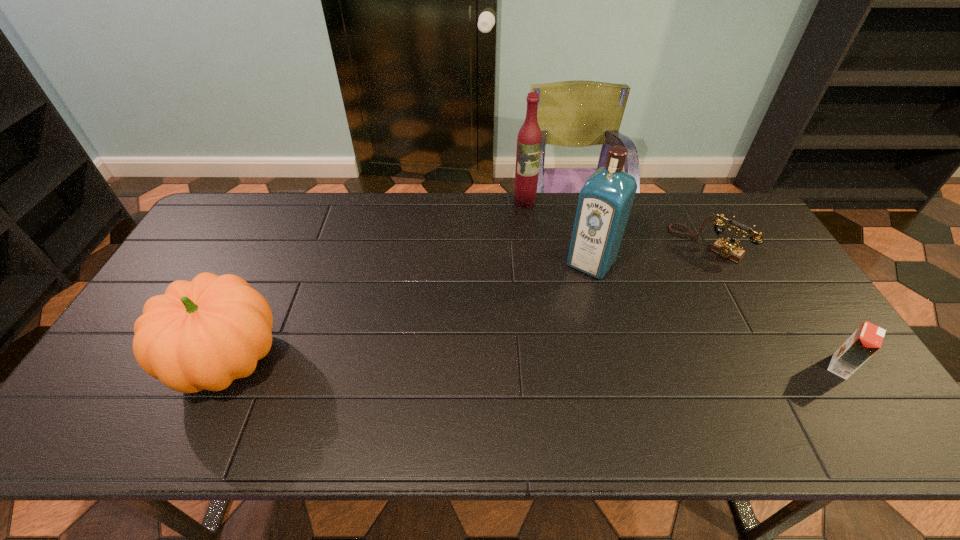
The height and width of the screenshot is (540, 960). Identify the location of vacant space on the desktop that is between the leftmost object and the orange juice and is positioned on the flat label side of the third object from left to right. (517, 363).

Where is `vacant space on the desktop that is between the leftmost object and the orange juice and is positioned on the label of the left liquor`? vacant space on the desktop that is between the leftmost object and the orange juice and is positioned on the label of the left liquor is located at coordinates (564, 363).

You are a GUI agent. You are given a task and a screenshot of the screen. Output one action in this format:
    pyautogui.click(x=<x>, y=<y>)
    Task: Click on the vacant space on the desktop that is between the third shortest object and the rightmost object and is positioned on the front-facing side of the second object from right to left
    Image resolution: width=960 pixels, height=540 pixels.
    Given the screenshot: What is the action you would take?
    pyautogui.click(x=588, y=364)